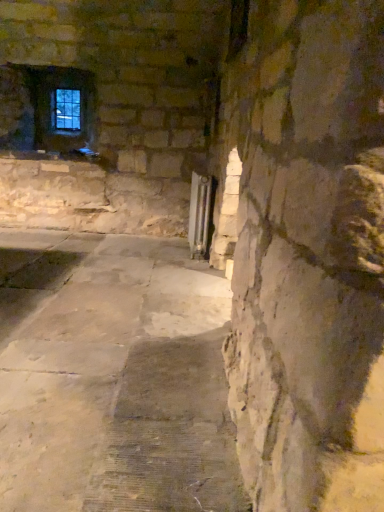
Question: Is clear glass window at upper left next to silver metallic radiator at center-right and touching it?

Choices:
 (A) no
 (B) yes

Answer: (A)

Question: Is silver metallic radiator at center-right located within clear glass window at upper left?

Choices:
 (A) yes
 (B) no

Answer: (B)

Question: Is clear glass window at upper left looking in the opposite direction of silver metallic radiator at center-right?

Choices:
 (A) no
 (B) yes

Answer: (A)

Question: Is clear glass window at upper left thinner than silver metallic radiator at center-right?

Choices:
 (A) yes
 (B) no

Answer: (A)

Question: From the image's perspective, does clear glass window at upper left appear lower than silver metallic radiator at center-right?

Choices:
 (A) no
 (B) yes

Answer: (A)

Question: Is clear glass window at upper left taller than silver metallic radiator at center-right?

Choices:
 (A) no
 (B) yes

Answer: (A)

Question: Is silver metallic radiator at center-right at the right side of clear glass window at upper left?

Choices:
 (A) yes
 (B) no

Answer: (A)

Question: From the image's perspective, does silver metallic radiator at center-right appear higher than clear glass window at upper left?

Choices:
 (A) yes
 (B) no

Answer: (B)

Question: Can you see silver metallic radiator at center-right touching clear glass window at upper left?

Choices:
 (A) no
 (B) yes

Answer: (A)

Question: From a real-world perspective, is silver metallic radiator at center-right below clear glass window at upper left?

Choices:
 (A) no
 (B) yes

Answer: (B)

Question: Can you confirm if silver metallic radiator at center-right is thinner than clear glass window at upper left?

Choices:
 (A) yes
 (B) no

Answer: (B)

Question: Is silver metallic radiator at center-right wider than clear glass window at upper left?

Choices:
 (A) yes
 (B) no

Answer: (A)

Question: In terms of height, does clear glass window at upper left look taller or shorter compared to silver metallic radiator at center-right?

Choices:
 (A) tall
 (B) short

Answer: (B)